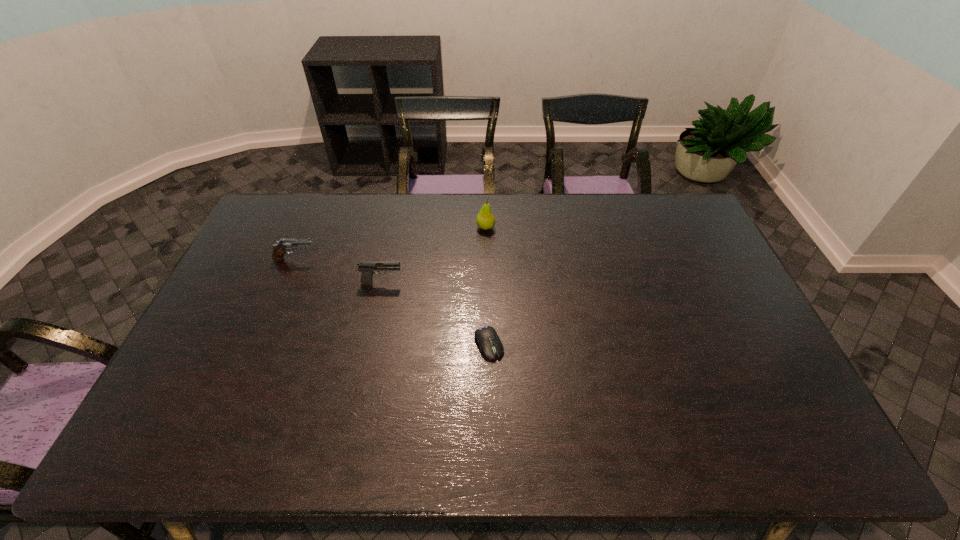
Identify the location of free region located 0.090m aim along the barrel of the right pistol. (431, 282).

Find the location of a particular element. Image resolution: width=960 pixels, height=540 pixels. free location located 0.120m on the left of the computer equipment is located at coordinates (431, 344).

Where is `object situated at the far edge`? Image resolution: width=960 pixels, height=540 pixels. object situated at the far edge is located at coordinates (485, 219).

Where is `object that is at the left edge`? This screenshot has height=540, width=960. object that is at the left edge is located at coordinates (280, 249).

Find the location of a particular element. This screenshot has height=540, width=960. vacant space at the far edge of the desktop is located at coordinates (339, 226).

Where is `vacant space at the left edge`? vacant space at the left edge is located at coordinates (202, 356).

Find the location of a particular element. The image size is (960, 540). vacant space at the right edge is located at coordinates (704, 268).

In the image, there is a desktop. At what (x,y) coordinates should I click in order to perform the action: click on free space at the far left corner. Please return your answer as a coordinate pair (x, y). Looking at the image, I should click on (314, 199).

Find the location of a particular element. The image size is (960, 540). vacant region between the third object from right to left and the third nearest object is located at coordinates (339, 271).

Where is `blank region between the farther pistol and the right pistol`? This screenshot has width=960, height=540. blank region between the farther pistol and the right pistol is located at coordinates coord(339,271).